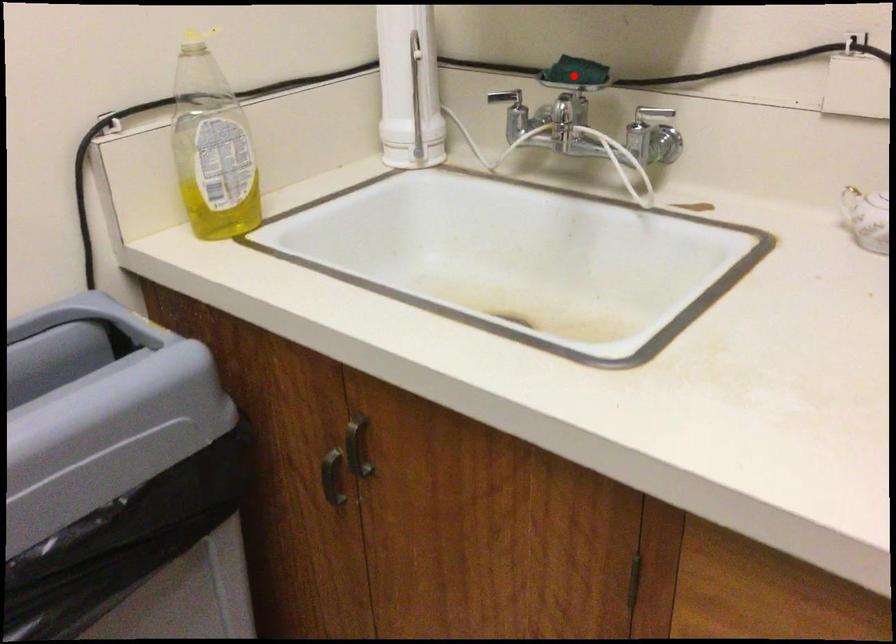
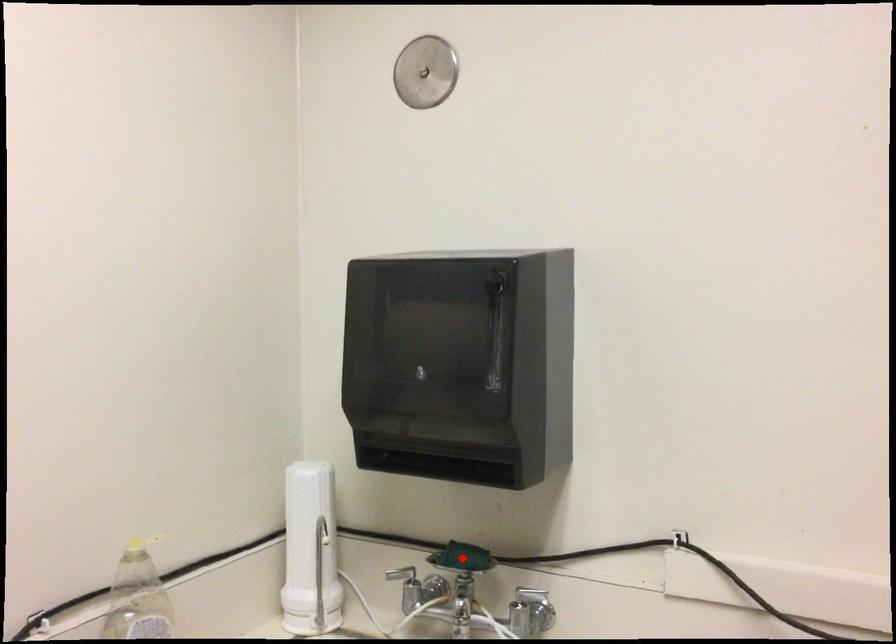
I am providing you with two images of the same scene from different viewpoints. A red point is marked on the first image and another point is marked on the second image. Is the red point in image1 aligned with the point shown in image2?

Yes